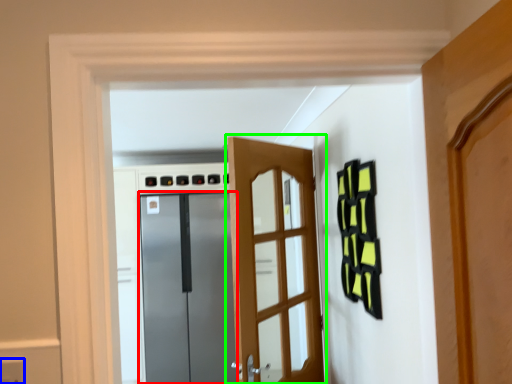
Question: Which object is positioned closest to door (highlighted by a red box)? Select from electric outlet (highlighted by a blue box) and door (highlighted by a green box).

Choices:
 (A) electric outlet
 (B) door

Answer: (B)